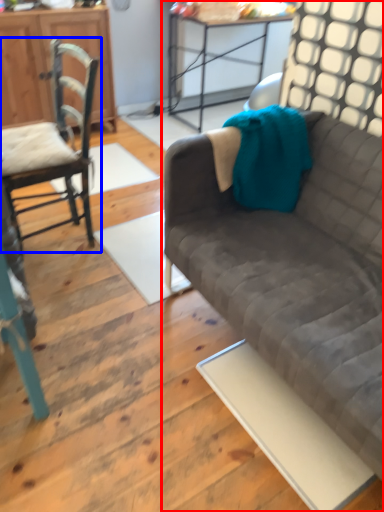
Question: Among these objects, which one is farthest to the camera, studio couch (highlighted by a red box) or chair (highlighted by a blue box)?

Choices:
 (A) studio couch
 (B) chair

Answer: (B)